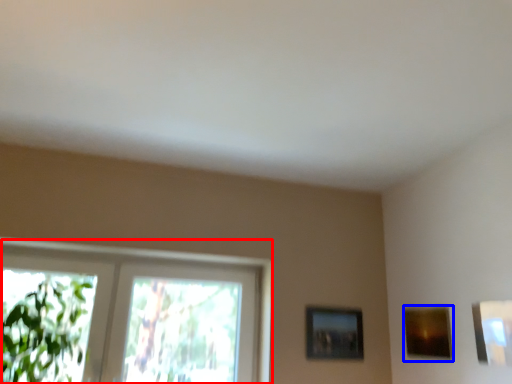
Question: Which object appears closest to the camera in this image, window (highlighted by a red box) or picture frame (highlighted by a blue box)?

Choices:
 (A) window
 (B) picture frame

Answer: (B)